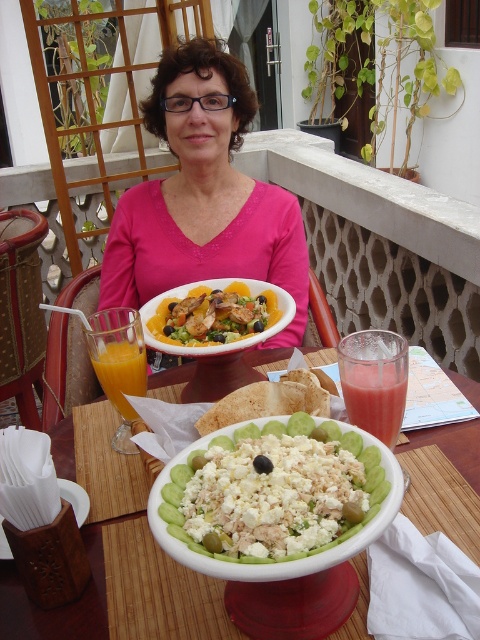
You are a guest at this outdoor dining table. You want to reach for the wooden tissue box at lower left but need to grab a napkin first. Where should you look relative to the white crumbly cheese salad at center?

The wooden tissue box at lower left is below the white crumbly cheese salad at center, so you should look downward from the white crumbly cheese salad at center to find it.

You are a waiter at this outdoor dining table. You need to place a small dessert plate between the white crumbly cheese salad at center and the wooden tissue box at lower left. Where should you place it?

The white crumbly cheese salad at center is to the right of the wooden tissue box at lower left, so the dessert plate should be placed between them, to the right of the wooden tissue box at lower left and to the left of the white crumbly cheese salad at center.